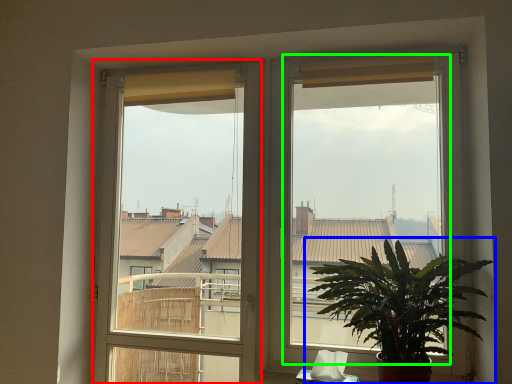
Question: Which object is positioned closest to window frame (highlighted by a red box)? Select from houseplant (highlighted by a blue box) and window screen (highlighted by a green box).

Choices:
 (A) houseplant
 (B) window screen

Answer: (B)